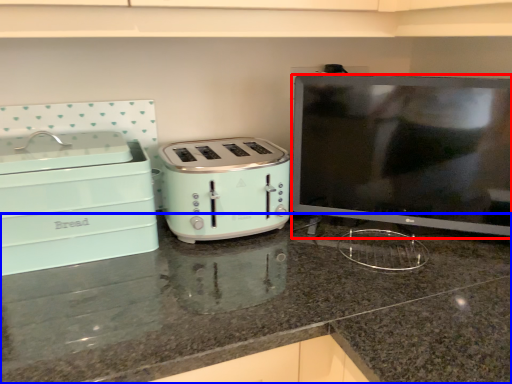
Question: Which point is closer to the camera, appliance (highlighted by a red box) or countertop (highlighted by a blue box)?

Choices:
 (A) appliance
 (B) countertop

Answer: (B)